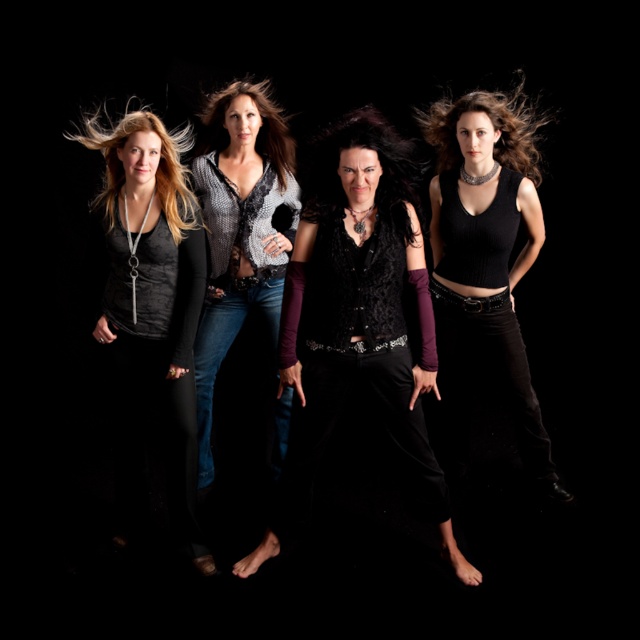
You are a photographer setting up a shoot. You notice the velvet black vest at center and the blonde silky hair at left in the scene. Which object is positioned to the right of the other?

The velvet black vest at center is to the right of blonde silky hair at left.

You are standing in front of the group of four people against the black background. You notice two points marked on the image at coordinates point (285, 360) and point (179, 138). Which point is closer to you?

Point (285, 360) is in front of point (179, 138), so it is closer to you.

You are a photographer adjusting the lighting for a group photo. You notice the velvet black vest at center and the blonde silky hair at left. Which object should you adjust the lighting for to ensure it doesn not get lost in the dark background? Explain your reasoning.

The velvet black vest at center should be adjusted because it is black and against a dark background, making it harder to see. The blonde silky hair at left is lighter and stands out more against the black background.